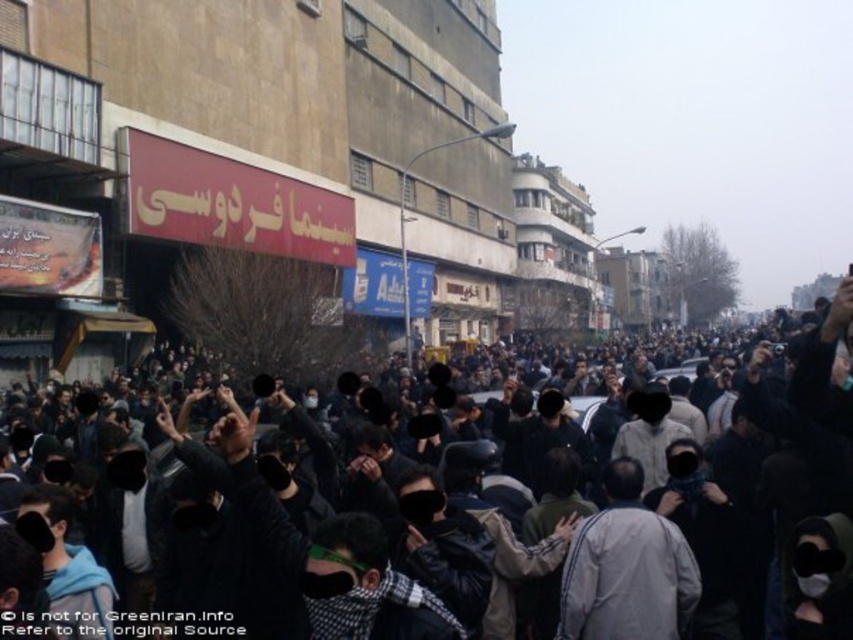
You are a delivery person trying to navigate through the urban area shown in the image. You need to deliver a package to a location behind the dark clothing crowd at center. Based on their position, can you estimate how far you need to walk around them to reach your destination?

The dark clothing crowd at center is located at point (x=424, y=541). Since the coordinates suggest they are positioned towards the lower middle of the image, you would need to walk around them either to the left or right to reach the destination behind them.